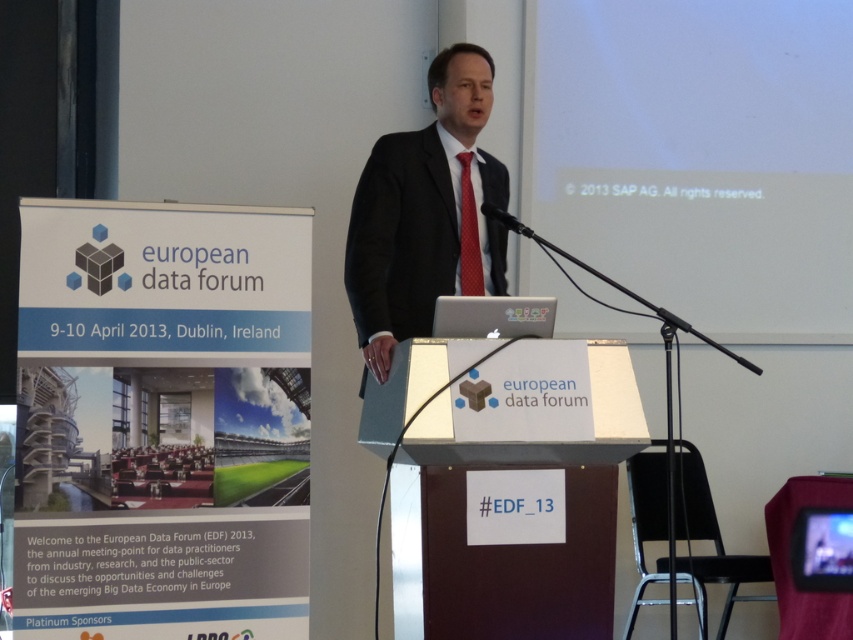
You are an attendee at the European Data Forum and want to take a photo of the presentation. The white matte projection screen at upper right and the red dotted tie at center are both in your camera frame. Which object should you focus on to ensure the projection screen is in focus?

You should focus on the white matte projection screen at upper right because it is taller than the red dotted tie at center, meaning it is farther away from the camera and thus requires a different focus setting.

You are attending the European Data Forum and want to take a photo of the speaker in the matte black suit at center without the white matte projection screen at upper right appearing in the shot. Is this possible based on their positions?

The matte black suit at center is behind the white matte projection screen at upper right, so it would not be visible in the photo if the screen is in front of them.